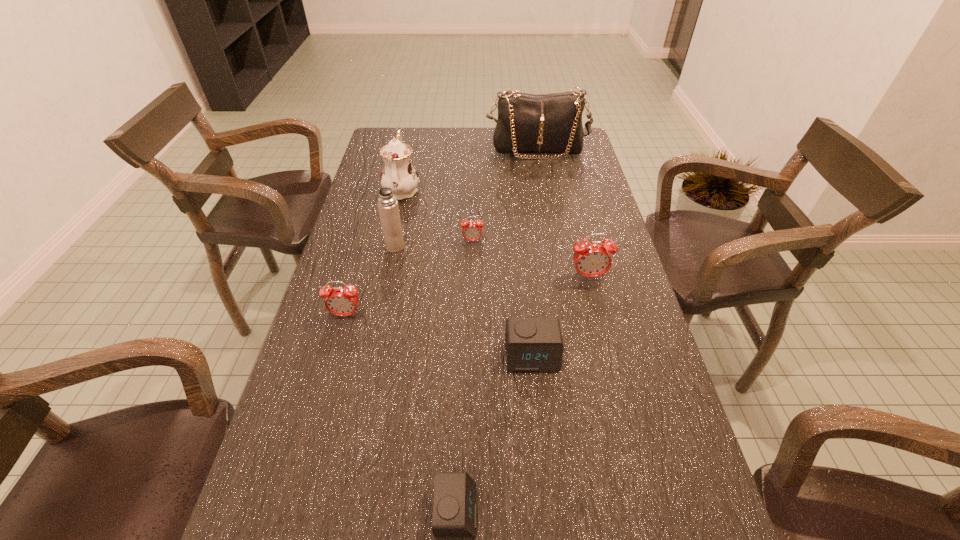
Locate an element on the screen. the farthest object is located at coordinates (544, 124).

Identify the location of the tallest object. Image resolution: width=960 pixels, height=540 pixels. (544, 124).

Find the location of a particular element. The height and width of the screenshot is (540, 960). chinaware is located at coordinates (398, 174).

Locate an element on the screen. The width and height of the screenshot is (960, 540). thermos bottle is located at coordinates (387, 204).

Identify the location of the second nearest red alarm clock. (593, 259).

Where is `the fifth shortest object`? Image resolution: width=960 pixels, height=540 pixels. the fifth shortest object is located at coordinates (593, 259).

The width and height of the screenshot is (960, 540). Identify the location of the second smallest red alarm clock. (339, 301).

You are a GUI agent. You are given a task and a screenshot of the screen. Output one action in this format:
    pyautogui.click(x=<x>, y=<y>)
    Task: Click on the sixth farthest object
    
    Given the screenshot: What is the action you would take?
    pyautogui.click(x=339, y=301)

Where is `the farthest red alarm clock`? The height and width of the screenshot is (540, 960). the farthest red alarm clock is located at coordinates (472, 231).

Where is `the smallest red alarm clock`? This screenshot has width=960, height=540. the smallest red alarm clock is located at coordinates (472, 231).